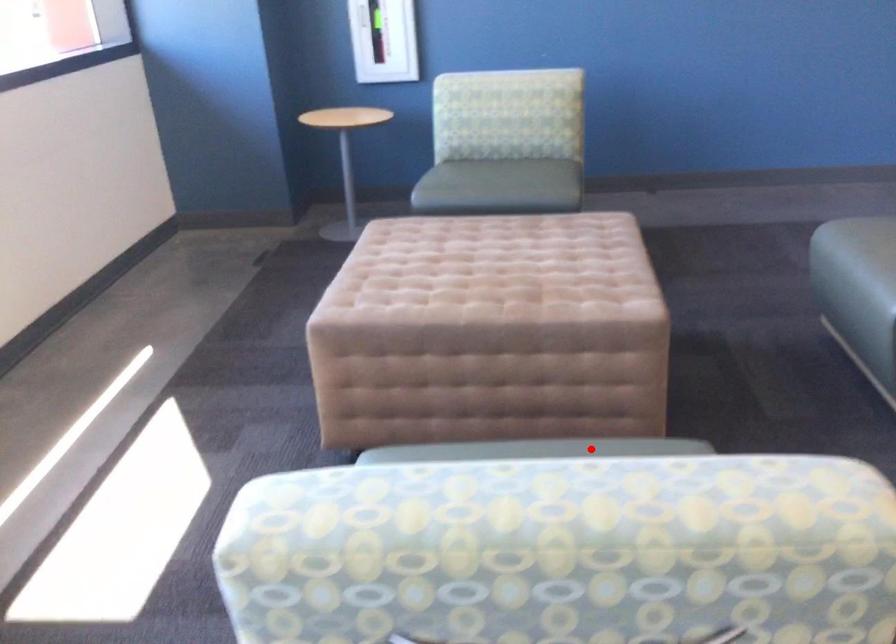
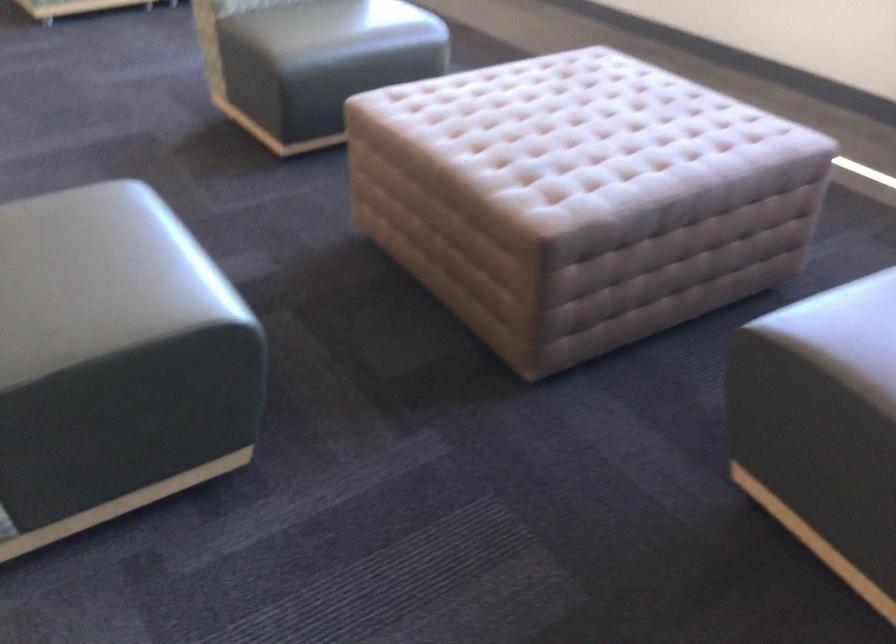
Question: I am providing you with two images of the same scene from different viewpoints. A red point is shown in image1. For the corresponding object point in image2, is it positioned nearer or farther from the camera?

Choices:
 (A) Nearer
 (B) Farther

Answer: (B)